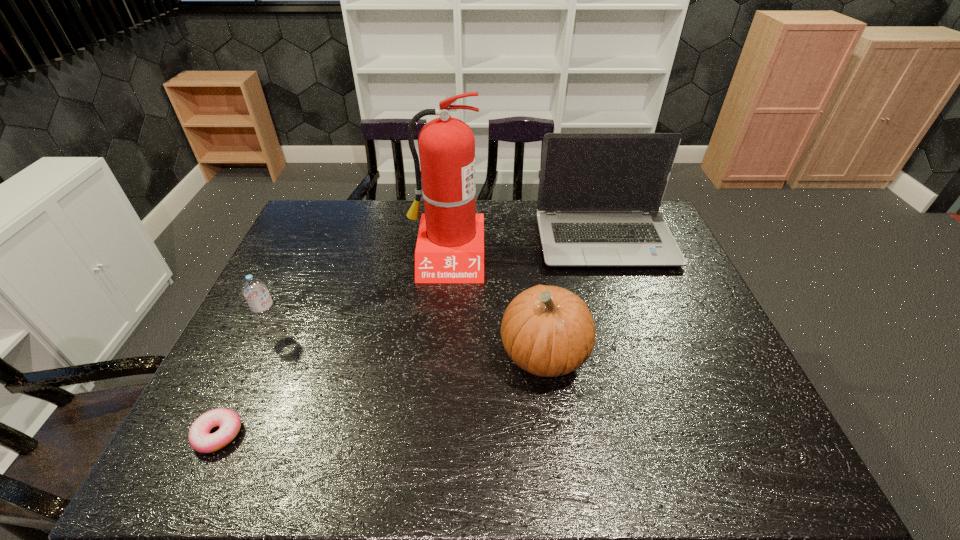
Where is `object located at the near left corner`? This screenshot has width=960, height=540. object located at the near left corner is located at coordinates (200, 439).

Find the location of `object that is positioned at the far right corner`. object that is positioned at the far right corner is located at coordinates (599, 195).

This screenshot has height=540, width=960. I want to click on free space at the far edge, so click(x=491, y=222).

Locate an element on the screen. Image resolution: width=960 pixels, height=540 pixels. blank space at the near edge of the desktop is located at coordinates (505, 451).

You are a GUI agent. You are given a task and a screenshot of the screen. Output one action in this format:
    pyautogui.click(x=<x>, y=<y>)
    Task: Click on the free space at the left edge of the desktop
    The image size is (960, 540).
    Given the screenshot: What is the action you would take?
    pyautogui.click(x=323, y=258)

Image resolution: width=960 pixels, height=540 pixels. I want to click on free spot at the right edge of the desktop, so click(x=643, y=268).

Locate an element on the screen. The width and height of the screenshot is (960, 540). free space at the far left corner of the desktop is located at coordinates (306, 237).

Where is `free space between the shortest object and the fourth tallest object`? This screenshot has width=960, height=540. free space between the shortest object and the fourth tallest object is located at coordinates (246, 383).

This screenshot has height=540, width=960. Identify the location of free point between the second tallest object and the fourth tallest object. (440, 287).

Locate an element on the screen. free space between the second shortest object and the tallest object is located at coordinates (361, 294).